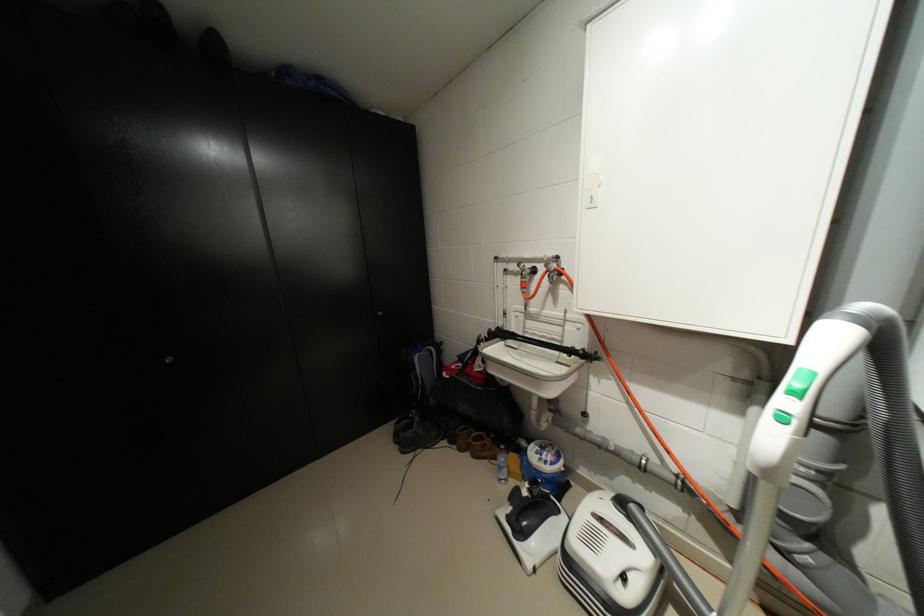
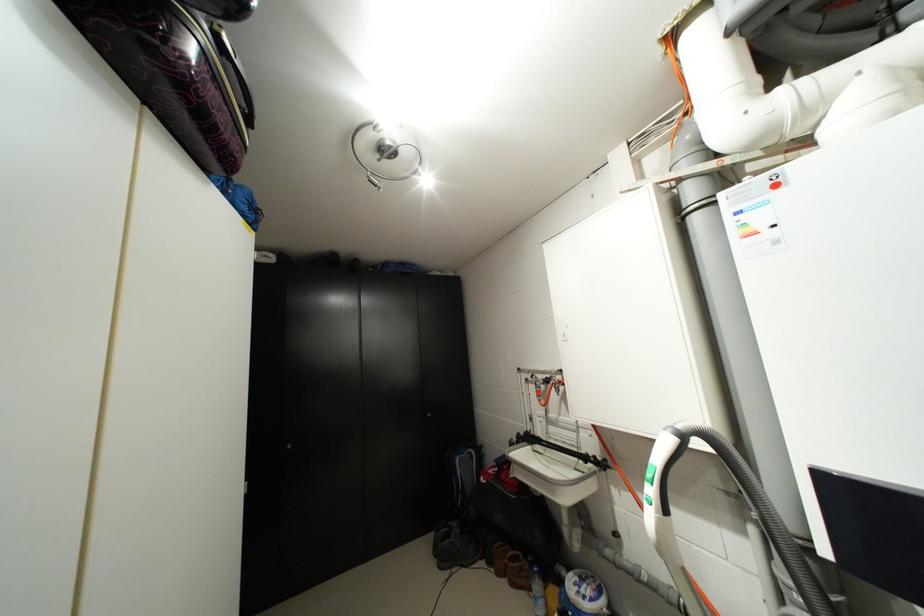
Question: The images are taken continuously from a first-person perspective. In which direction is your viewpoint rotating?

Choices:
 (A) Left
 (B) Right
 (C) Up
 (D) Down

Answer: (C)